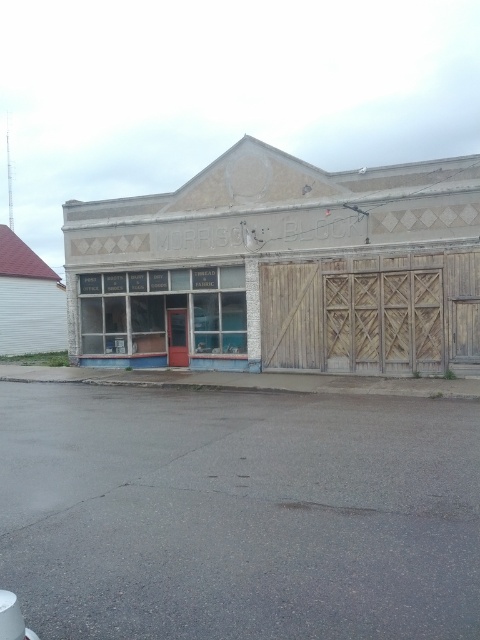
You are a delivery person approaching the Morrison Block storefront. You need to place a package on the white painted wood storefront at center and the wooden at right. According to the spatial arrangement, which object should you approach first from the front of the building?

The white painted wood storefront at center should be approached first because it is positioned on the left side of the wooden at right, meaning it is closer to the front entrance.

You are a delivery person with a cart that is 15 feet wide. You need to move from the wooden at right to the red wood door at center. Is there enough space for your cart to pass through the gap between them?

The wooden at right and red wood door at center are 20.11 feet apart, so yes, the cart can pass through the gap since it is wider than the cart.

You are a delivery person trying to unload a large package that is 1.2 meters wide. You see the wooden at right and the red wood door at center. Which entrance can you use to get the package inside?

The wooden at right might be wider than red wood door at center, so you should use the wooden at right to get the package inside since it is wider than the red wood door at center and the package is 1.2 meters wide.